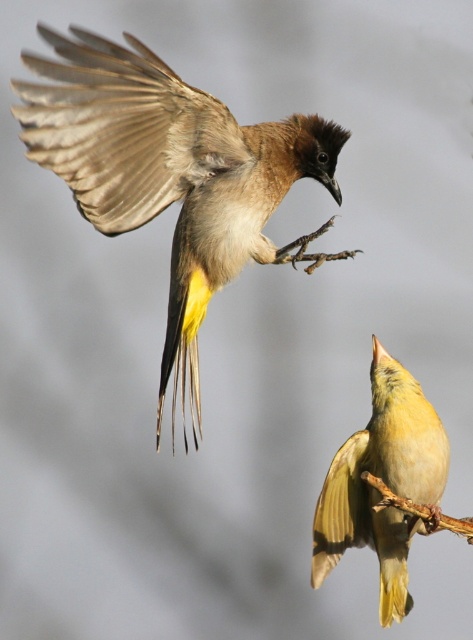
Question: Which point is farther to the camera?

Choices:
 (A) (344, 442)
 (B) (260, 193)

Answer: (A)

Question: Does brown feathered bird at upper left appear on the right side of yellow-green feathers at center?

Choices:
 (A) yes
 (B) no

Answer: (B)

Question: Does brown feathered bird at upper left have a smaller size compared to yellow-green feathers at center?

Choices:
 (A) no
 (B) yes

Answer: (A)

Question: Among these points, which one is nearest to the camera?

Choices:
 (A) coord(320,260)
 (B) coord(431,480)

Answer: (B)

Question: Is brown feathered bird at upper left to the right of yellow-green feathers at center from the viewer's perspective?

Choices:
 (A) no
 (B) yes

Answer: (A)

Question: Which point is closer to the camera?

Choices:
 (A) (221, 188)
 (B) (350, 467)

Answer: (B)